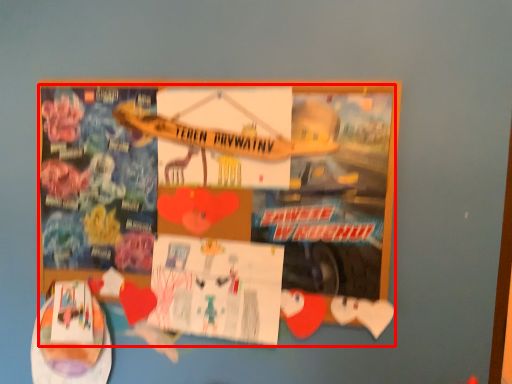
Question: Where is poster (annotated by the red box) located in relation to flyer in the image?

Choices:
 (A) left
 (B) right

Answer: (A)